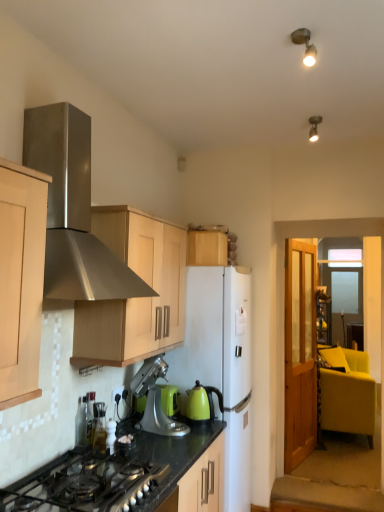
This screenshot has width=384, height=512. Identify the location of free point in front of green matte kettle at center, the 1th kitchen appliance in the right-to-left sequence. (200, 432).